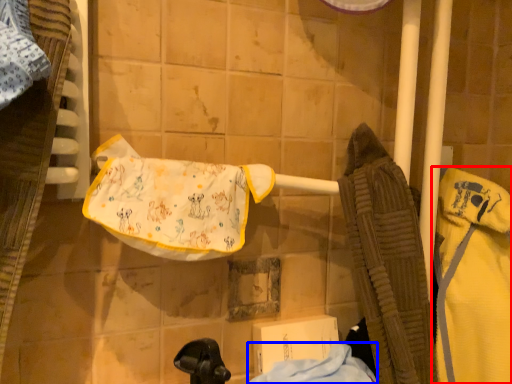
Question: Which object appears closest to the camera in this image, bathrobe (highlighted by a red box) or cloth (highlighted by a blue box)?

Choices:
 (A) bathrobe
 (B) cloth

Answer: (B)